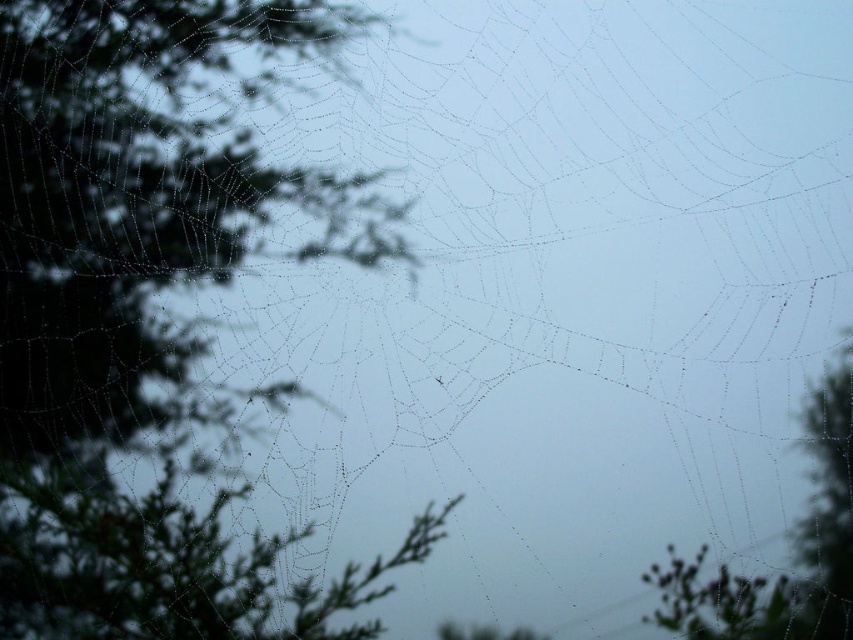
Question: Can you confirm if green leafy tree at left is bigger than green leafy tree at right?

Choices:
 (A) no
 (B) yes

Answer: (B)

Question: Can you confirm if green leafy tree at left is positioned below green leafy tree at right?

Choices:
 (A) no
 (B) yes

Answer: (A)

Question: Which of the following is the farthest from the observer?

Choices:
 (A) (149, 182)
 (B) (700, 630)

Answer: (A)

Question: Is green leafy tree at left positioned in front of green leafy tree at right?

Choices:
 (A) yes
 (B) no

Answer: (B)